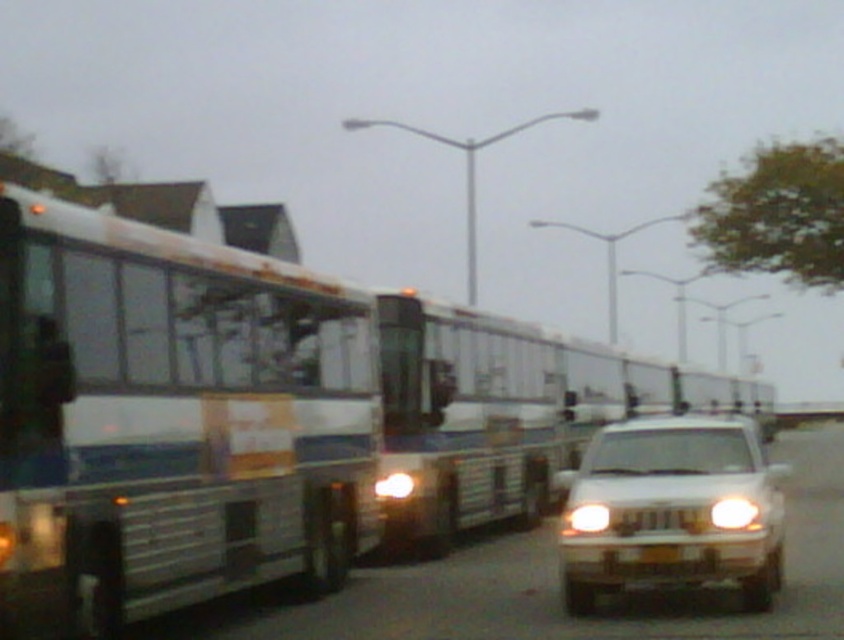
Looking at this image, you are a pedestrian standing at the edge of the road where the white glossy suv at lower right and the white plastic headlight at center are visible. Which object is nearer to you?

The white glossy suv at lower right is closer to the viewer than the white plastic headlight at center.

You are a pedestrian standing at the edge of the road where the white glossy suv at lower right and the white plastic headlight at center are located. You want to cross the road safely. Considering their widths, which vehicle should you avoid stepping in front of first?

The white glossy suv at lower right has a greater width than the white plastic headlight at center, so you should avoid stepping in front of the white glossy suv at lower right first because it is wider and poses a larger obstacle.